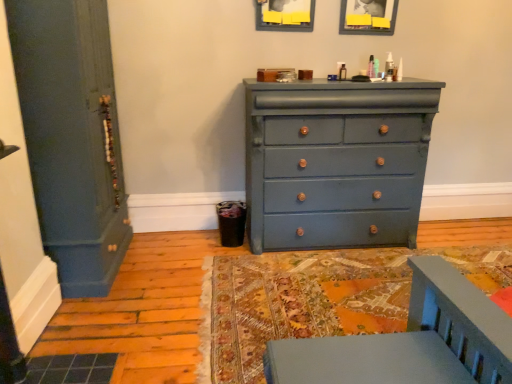
What is the approximate height of matte wooden picture frame at upper center, positioned as the 1th picture frame in right-to-left order?

matte wooden picture frame at upper center, positioned as the 1th picture frame in right-to-left order, is 13.30 inches tall.

This screenshot has height=384, width=512. Find the location of `matte wooden picture frame at upper center, positioned as the second picture frame in left-to-right order`. matte wooden picture frame at upper center, positioned as the second picture frame in left-to-right order is located at coordinates (368, 17).

Identify the location of matte gray picture frame at upper center, positioned as the second picture frame in right-to-left order. Image resolution: width=512 pixels, height=384 pixels. (285, 15).

What do you see at coordinates (336, 162) in the screenshot? I see `matte blue dresser at center` at bounding box center [336, 162].

What is the approximate height of matte blue door at left?

1.70 meters.

I want to click on matte blue door at left, so click(x=72, y=137).

What are the coordinates of `matte wooden picture frame at upper center, positioned as the second picture frame in left-to-right order` in the screenshot? It's located at (368, 17).

Is matte blue dresser at center turned away from matte wooden picture frame at upper center, positioned as the 1th picture frame in right-to-left order?

matte blue dresser at center does not have its back to matte wooden picture frame at upper center, positioned as the 1th picture frame in right-to-left order.

Which object is further away from the camera taking this photo, matte blue dresser at center or matte wooden picture frame at upper center, positioned as the 1th picture frame in right-to-left order?

matte wooden picture frame at upper center, positioned as the 1th picture frame in right-to-left order, is further away from the camera.

This screenshot has height=384, width=512. Find the location of `picture frame lying on the right of matte blue dresser at center`. picture frame lying on the right of matte blue dresser at center is located at coordinates (368, 17).

Is point (364, 169) closer or farther from the camera than point (99, 13)?

Point (364, 169) is positioned farther from the camera compared to point (99, 13).

In the scene shown: Which is more to the left, matte blue dresser at center or matte blue door at left?

Positioned to the left is matte blue door at left.

Does matte blue dresser at center have a larger size compared to matte blue door at left?

No.

In the scene shown: Is matte blue dresser at center surrounding matte gray picture frame at upper center, positioned as the second picture frame in right-to-left order?

No, matte gray picture frame at upper center, positioned as the second picture frame in right-to-left order, is not a part of matte blue dresser at center.

In the scene shown: Between matte blue dresser at center and matte gray picture frame at upper center, acting as the first picture frame starting from the left, which one has larger size?

Bigger between the two is matte blue dresser at center.

Looking at their sizes, would you say matte blue dresser at center is wider or thinner than matte gray picture frame at upper center, positioned as the second picture frame in right-to-left order?

Considering their sizes, matte blue dresser at center looks broader than matte gray picture frame at upper center, positioned as the second picture frame in right-to-left order.

Does matte blue dresser at center turn towards matte gray picture frame at upper center, positioned as the second picture frame in right-to-left order?

No, matte blue dresser at center is not turned towards matte gray picture frame at upper center, positioned as the second picture frame in right-to-left order.

Between matte blue door at left and matte gray picture frame at upper center, positioned as the second picture frame in right-to-left order, which one is positioned behind?

matte gray picture frame at upper center, positioned as the second picture frame in right-to-left order, is further away from the camera.

Which is behind, point (111, 174) or point (300, 4)?

The point (300, 4) is behind.

Can you confirm if matte blue door at left is smaller than matte gray picture frame at upper center, acting as the first picture frame starting from the left?

No, matte blue door at left is not smaller than matte gray picture frame at upper center, acting as the first picture frame starting from the left.

Is matte blue door at left next to matte gray picture frame at upper center, positioned as the second picture frame in right-to-left order?

matte blue door at left and matte gray picture frame at upper center, positioned as the second picture frame in right-to-left order, are not in contact.

Does point (282, 1) lie behind point (89, 227)?

That is True.

Which object is positioned more to the left, matte gray picture frame at upper center, acting as the first picture frame starting from the left, or matte blue door at left?

Positioned to the left is matte blue door at left.

Is matte gray picture frame at upper center, acting as the first picture frame starting from the left, outside of matte blue door at left?

That's correct, matte gray picture frame at upper center, acting as the first picture frame starting from the left, is outside of matte blue door at left.

Between matte blue door at left and matte wooden picture frame at upper center, positioned as the second picture frame in left-to-right order, which one has smaller width?

matte wooden picture frame at upper center, positioned as the second picture frame in left-to-right order.

Consider the image. Could you tell me if matte blue door at left is turned towards matte wooden picture frame at upper center, positioned as the 1th picture frame in right-to-left order?

Yes, matte blue door at left is turned towards matte wooden picture frame at upper center, positioned as the 1th picture frame in right-to-left order.

From the image's perspective, which is above, matte blue door at left or matte wooden picture frame at upper center, positioned as the second picture frame in left-to-right order?

matte wooden picture frame at upper center, positioned as the second picture frame in left-to-right order, appears higher in the image.

Does matte blue door at left have a lesser height compared to matte wooden picture frame at upper center, positioned as the second picture frame in left-to-right order?

No, matte blue door at left is not shorter than matte wooden picture frame at upper center, positioned as the second picture frame in left-to-right order.

Is point (341, 24) less distant than point (72, 116)?

That is False.

Considering the sizes of objects matte wooden picture frame at upper center, positioned as the 1th picture frame in right-to-left order, and matte blue door at left in the image provided, who is smaller, matte wooden picture frame at upper center, positioned as the 1th picture frame in right-to-left order, or matte blue door at left?

matte wooden picture frame at upper center, positioned as the 1th picture frame in right-to-left order.

Are matte wooden picture frame at upper center, positioned as the second picture frame in left-to-right order, and matte blue door at left located far from each other?

That's right, there is a large distance between matte wooden picture frame at upper center, positioned as the second picture frame in left-to-right order, and matte blue door at left.

From the image's perspective, would you say matte wooden picture frame at upper center, positioned as the second picture frame in left-to-right order, is positioned over matte blue door at left?

Yes, from the image's perspective, matte wooden picture frame at upper center, positioned as the second picture frame in left-to-right order, is over matte blue door at left.

In the image, there is a matte wooden picture frame at upper center, positioned as the 1th picture frame in right-to-left order. Where is `the chest of drawers below it (from a real-world perspective)`? the chest of drawers below it (from a real-world perspective) is located at coordinates (336, 162).

You are a GUI agent. You are given a task and a screenshot of the screen. Output one action in this format:
    pyautogui.click(x=<x>, y=<y>)
    Task: Click on the door above the matte blue dresser at center (from a real-world perspective)
    The height and width of the screenshot is (384, 512).
    Given the screenshot: What is the action you would take?
    pyautogui.click(x=72, y=137)

From the image, which object appears to be farther from matte wooden picture frame at upper center, positioned as the 1th picture frame in right-to-left order, matte blue door at left or matte blue dresser at center?

Among the two, matte blue door at left is located further to matte wooden picture frame at upper center, positioned as the 1th picture frame in right-to-left order.

Estimate the real-world distances between objects in this image. Which object is further from matte blue door at left, matte gray picture frame at upper center, acting as the first picture frame starting from the left, or matte blue dresser at center?

matte gray picture frame at upper center, acting as the first picture frame starting from the left.

Looking at this image, based on their spatial positions, is matte gray picture frame at upper center, acting as the first picture frame starting from the left, or matte blue door at left further from matte wooden picture frame at upper center, positioned as the 1th picture frame in right-to-left order?

matte blue door at left is positioned further to the anchor matte wooden picture frame at upper center, positioned as the 1th picture frame in right-to-left order.

Which object lies nearer to the anchor point matte gray picture frame at upper center, positioned as the second picture frame in right-to-left order, matte blue dresser at center or matte wooden picture frame at upper center, positioned as the second picture frame in left-to-right order?

matte wooden picture frame at upper center, positioned as the second picture frame in left-to-right order, is positioned closer to the anchor matte gray picture frame at upper center, positioned as the second picture frame in right-to-left order.

When comparing their distances from matte blue dresser at center, does matte wooden picture frame at upper center, positioned as the second picture frame in left-to-right order, or matte gray picture frame at upper center, acting as the first picture frame starting from the left, seem further?

matte gray picture frame at upper center, acting as the first picture frame starting from the left.

Looking at the image, which one is located further to matte gray picture frame at upper center, acting as the first picture frame starting from the left, matte wooden picture frame at upper center, positioned as the 1th picture frame in right-to-left order, or matte blue dresser at center?

matte blue dresser at center.

When comparing their distances from matte wooden picture frame at upper center, positioned as the second picture frame in left-to-right order, does matte blue dresser at center or matte gray picture frame at upper center, positioned as the second picture frame in right-to-left order, seem closer?

matte gray picture frame at upper center, positioned as the second picture frame in right-to-left order.

Considering their positions, is matte gray picture frame at upper center, positioned as the second picture frame in right-to-left order, positioned further to matte wooden picture frame at upper center, positioned as the 1th picture frame in right-to-left order, than matte blue dresser at center?

Based on the image, matte blue dresser at center appears to be further to matte wooden picture frame at upper center, positioned as the 1th picture frame in right-to-left order.

Find the location of a particular element. chest of drawers between matte blue door at left and matte wooden picture frame at upper center, positioned as the second picture frame in left-to-right order, from left to right is located at coordinates (336, 162).

The image size is (512, 384). What are the coordinates of `picture frame between matte blue door at left and matte blue dresser at center` in the screenshot? It's located at (285, 15).

The width and height of the screenshot is (512, 384). In order to click on picture frame between matte blue door at left and matte wooden picture frame at upper center, positioned as the 1th picture frame in right-to-left order, from left to right in this screenshot , I will do `click(285, 15)`.

Find the location of a particular element. picture frame between matte wooden picture frame at upper center, positioned as the 1th picture frame in right-to-left order, and matte blue dresser at center vertically is located at coordinates coord(285,15).